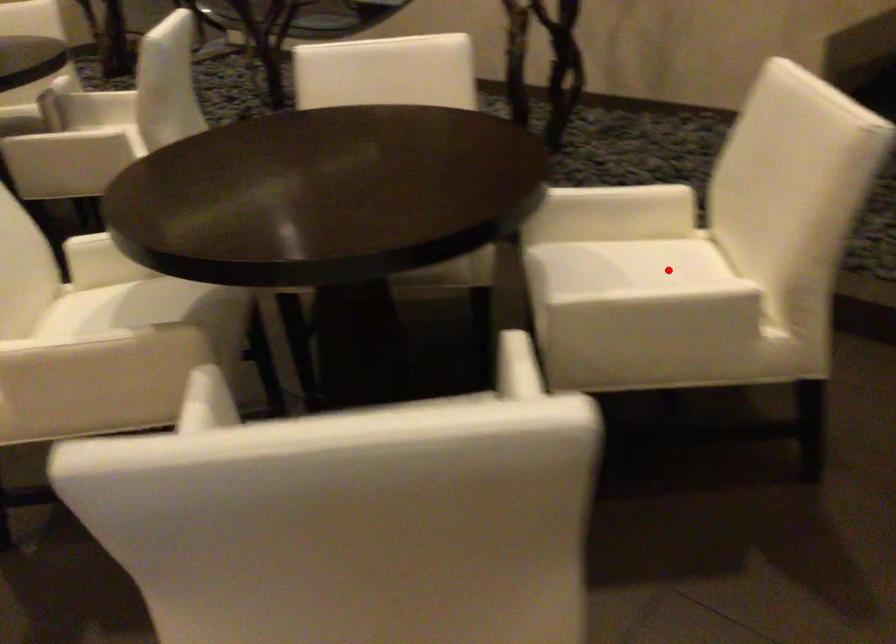
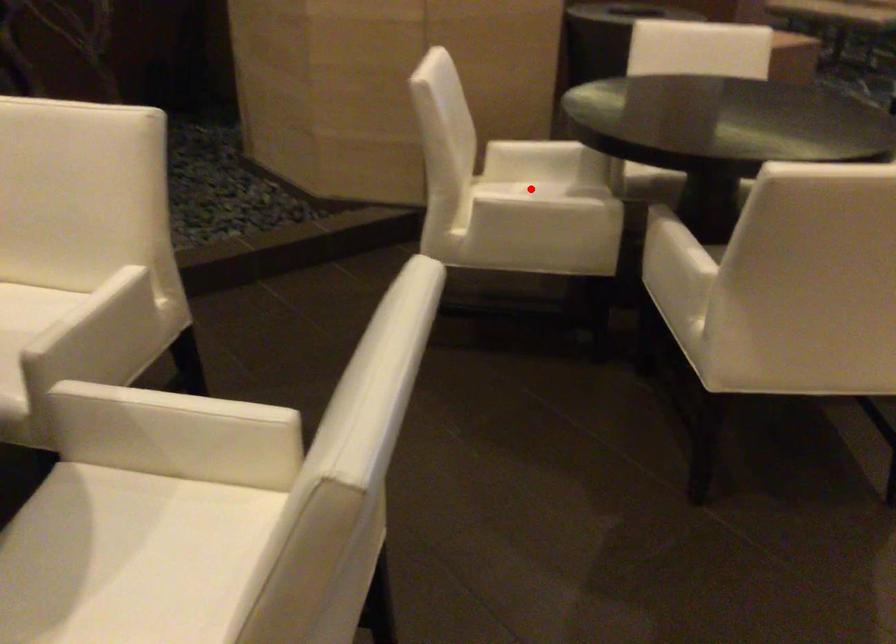
I am providing you with two images of the same scene from different viewpoints. A red point is marked on the first image and another point is marked on the second image. Is the marked point in image1 the same physical position as the marked point in image2?

No